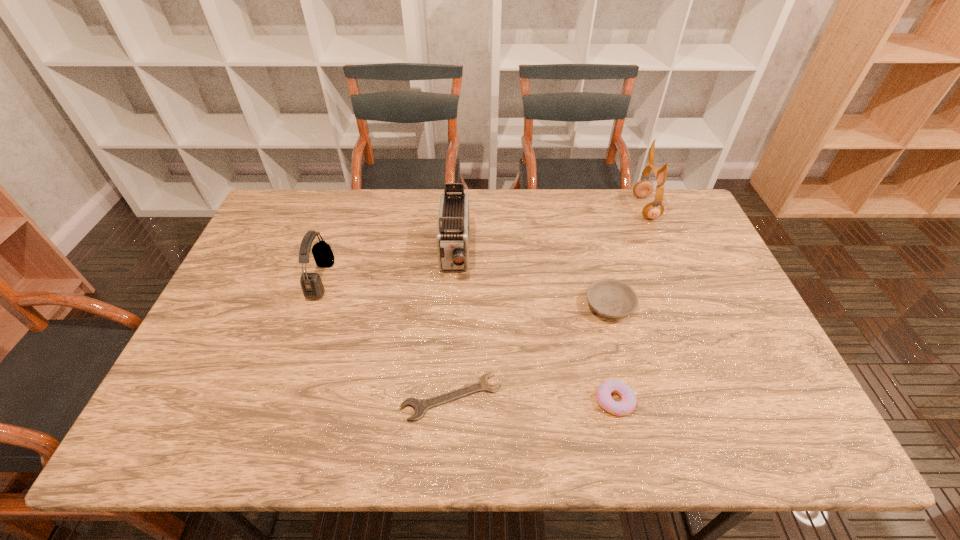
Locate an element on the screen. This screenshot has width=960, height=540. vacant region located 0.060m on the front-facing side of the farthest object is located at coordinates coord(617,208).

Identify the location of free region located 0.190m at the lens of the camcorder. The height and width of the screenshot is (540, 960). 449,337.

The height and width of the screenshot is (540, 960). I want to click on blank space located 0.270m on the headband of the headset, so click(422, 279).

You are a GUI agent. You are given a task and a screenshot of the screen. Output one action in this format:
    pyautogui.click(x=<x>, y=<y>)
    Task: Click on the vacant space located on the left of the third shortest object
    This screenshot has height=540, width=960.
    Given the screenshot: What is the action you would take?
    point(439,306)

Find the location of a particular element. vacant space located on the back of the fifth tallest object is located at coordinates (588, 285).

The image size is (960, 540). What are the coordinates of `vacant space located on the right of the wrench` in the screenshot? It's located at (584, 397).

The height and width of the screenshot is (540, 960). I want to click on earphone that is at the far edge, so click(644, 188).

The width and height of the screenshot is (960, 540). Identify the location of camcorder that is at the far edge. (452, 238).

At what (x,y) coordinates should I click in order to perform the action: click on doughnut at the near edge. Please return your answer as a coordinate pair (x, y). Looking at the image, I should click on (628, 402).

The image size is (960, 540). Find the location of `wrench that is at the near edge`. wrench that is at the near edge is located at coordinates pyautogui.click(x=420, y=406).